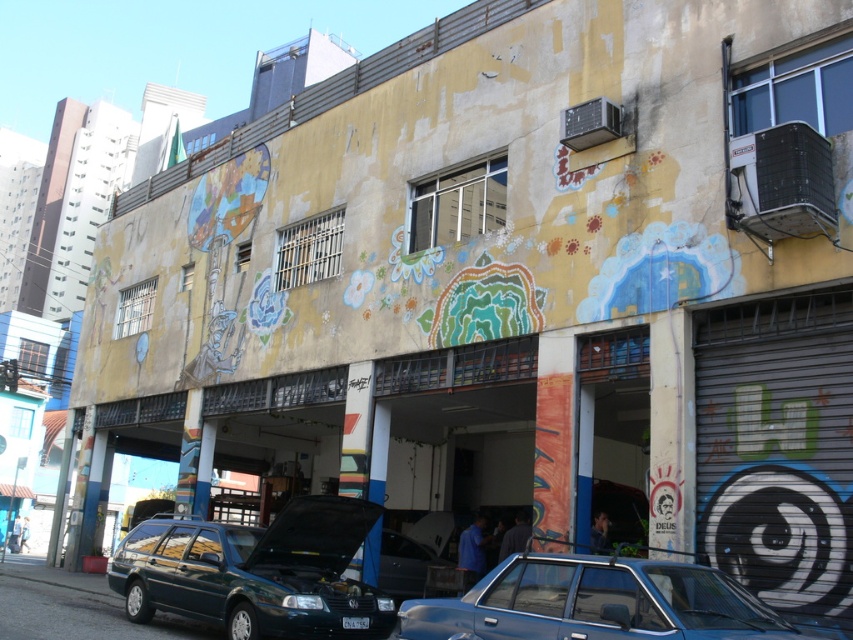
Locate an element on the screen. This screenshot has width=853, height=640. green matte station wagon at lower center is located at coordinates (256, 572).

Looking at this image, who is positioned more to the left, green matte station wagon at lower center or metallic blue sedan at lower center?

Positioned to the left is green matte station wagon at lower center.

Which is behind, point (247, 556) or point (670, 573)?

Point (247, 556)

Find the location of `green matte station wagon at lower center`. green matte station wagon at lower center is located at coordinates (256, 572).

Describe the element at coordinates (256, 572) in the screenshot. I see `green matte station wagon at lower center` at that location.

Is green matte station wagon at lower center shorter than white plastic license plate at center?

No, green matte station wagon at lower center is not shorter than white plastic license plate at center.

The height and width of the screenshot is (640, 853). What do you see at coordinates (256, 572) in the screenshot?
I see `green matte station wagon at lower center` at bounding box center [256, 572].

The width and height of the screenshot is (853, 640). Find the location of `green matte station wagon at lower center`. green matte station wagon at lower center is located at coordinates (256, 572).

Does metallic blue sedan at lower center have a greater width compared to white plastic license plate at center?

Yes, metallic blue sedan at lower center is wider than white plastic license plate at center.

Who is lower down, metallic blue sedan at lower center or white plastic license plate at center?

white plastic license plate at center

In order to click on metallic blue sedan at lower center in this screenshot , I will do `click(596, 604)`.

Find the location of `metallic blue sedan at lower center`. metallic blue sedan at lower center is located at coordinates (596, 604).